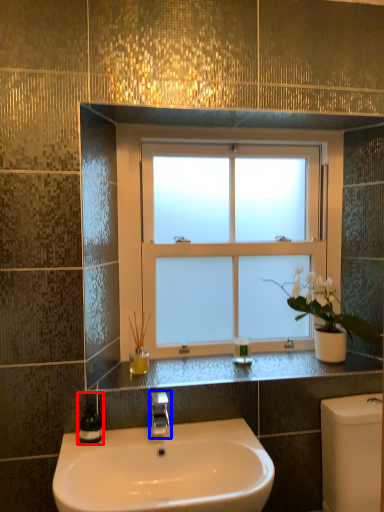
Question: Which object is closer to the camera taking this photo, soap dispenser (highlighted by a red box) or tap (highlighted by a blue box)?

Choices:
 (A) soap dispenser
 (B) tap

Answer: (B)